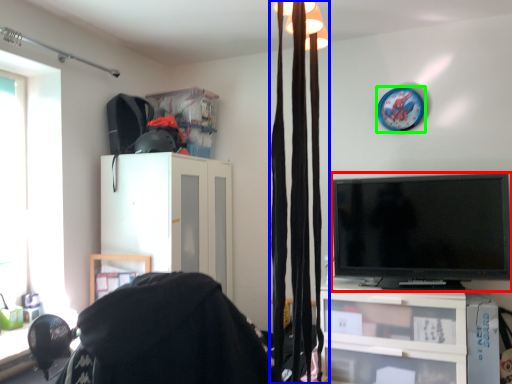
Question: Based on their relative distances, which object is farther from television (highlighted by a red box)? Choose from curtain (highlighted by a blue box) and clock (highlighted by a green box).

Choices:
 (A) curtain
 (B) clock

Answer: (A)